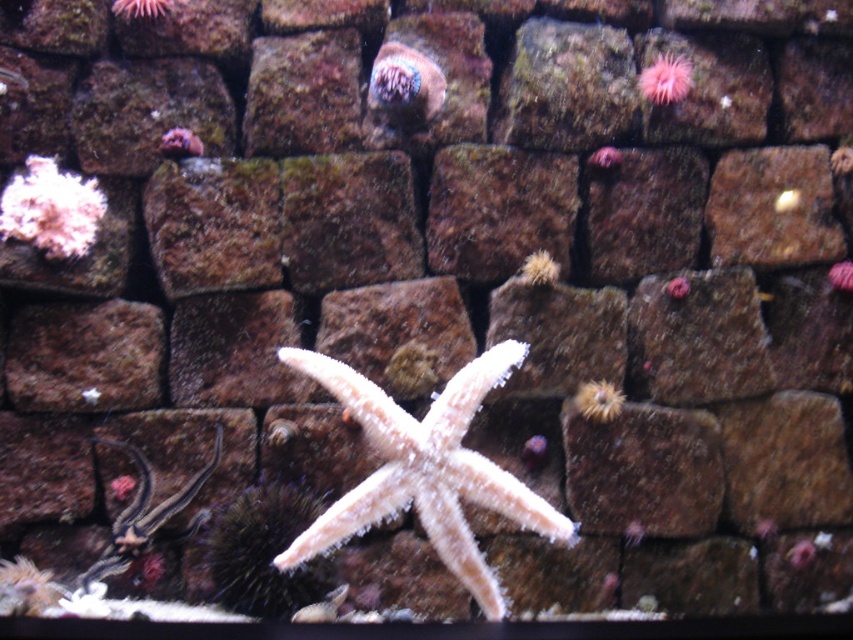
From the picture: You are a marine biologist studying underwater structures. You observe the shiny blue coral at upper center in the image. Based on its coordinates, can you determine its position relative to the starfish and the stone wall?

The shiny blue coral at upper center is located at coordinates point (405, 83), which places it above and to the left of the starfish and the stone wall.